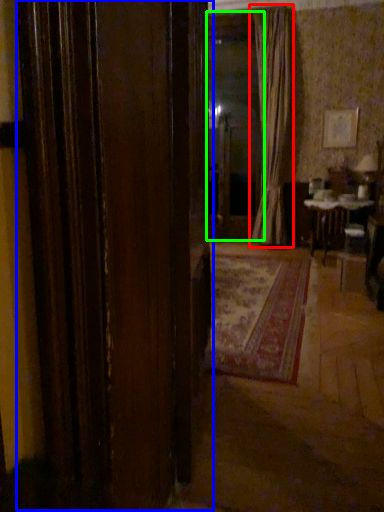
Question: Considering the real-world distances, which object is closest to curtain (highlighted by a red box)? door (highlighted by a blue box) or window screen (highlighted by a green box).

Choices:
 (A) door
 (B) window screen

Answer: (B)